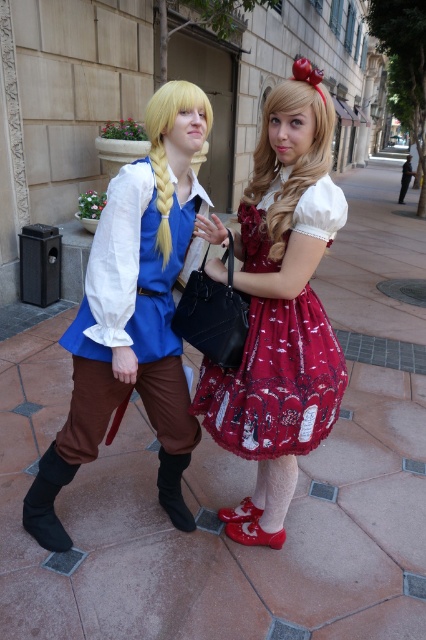
Question: Which of the following is the farthest from the observer?

Choices:
 (A) black suede boot at lower center
 (B) matte blue shirt at center
 (C) black leather boot at lower left

Answer: (A)

Question: Which point appears farthest from the camera in this image?

Choices:
 (A) (109, 378)
 (B) (161, 458)
 (C) (236, 445)
 (D) (48, 516)

Answer: (B)

Question: Can you confirm if black leather boot at lower left is positioned below black suede boot at lower center?

Choices:
 (A) no
 (B) yes

Answer: (A)

Question: Is matte blue shirt at center smaller than black suede boot at lower center?

Choices:
 (A) yes
 (B) no

Answer: (B)

Question: Which object is the closest to the black leather boot at lower left?

Choices:
 (A) matte blue shirt at center
 (B) velvet red dress at center
 (C) black suede boot at lower center

Answer: (A)

Question: Can you confirm if matte blue shirt at center is wider than black suede boot at lower center?

Choices:
 (A) yes
 (B) no

Answer: (A)